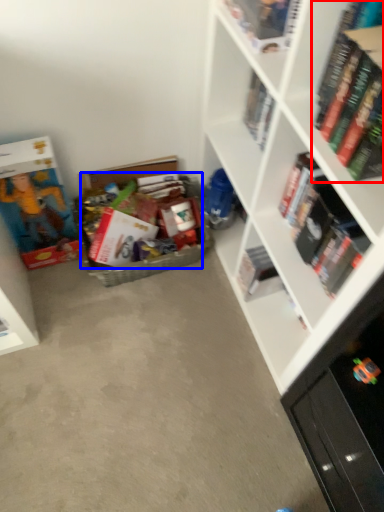
Question: Which point is further to the camera, book (highlighted by a red box) or book (highlighted by a blue box)?

Choices:
 (A) book
 (B) book

Answer: (B)